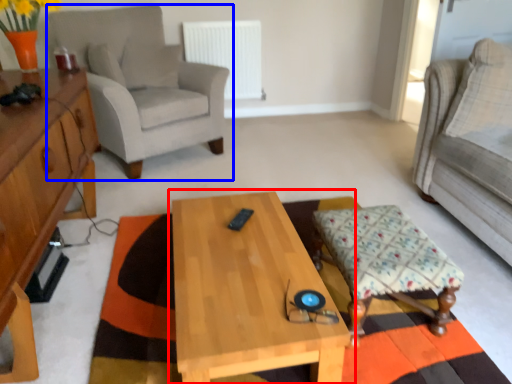
Question: Which object appears farthest to the camera in this image, coffee table (highlighted by a red box) or chair (highlighted by a blue box)?

Choices:
 (A) coffee table
 (B) chair

Answer: (B)